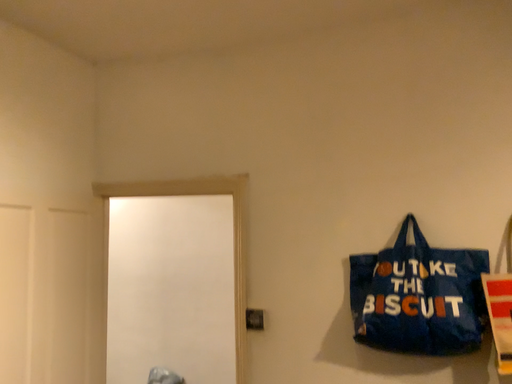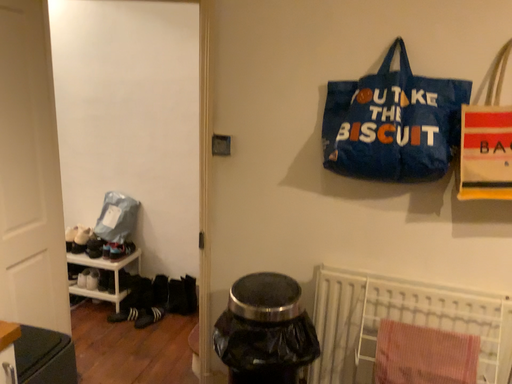
Question: Which way did the camera rotate in the video?

Choices:
 (A) rotated downward
 (B) rotated upward

Answer: (A)